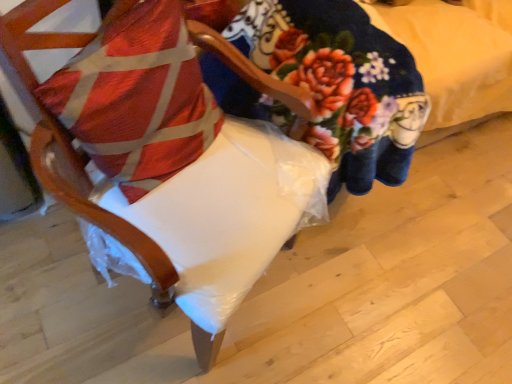
Question: Is textured red pillow at left taller or shorter than white fabric chair at center?

Choices:
 (A) short
 (B) tall

Answer: (A)

Question: Is textured red pillow at left spatially inside white fabric chair at center, or outside of it?

Choices:
 (A) outside
 (B) inside

Answer: (B)

Question: From a real-world perspective, is textured red pillow at left positioned above or below white fabric chair at center?

Choices:
 (A) below
 (B) above

Answer: (B)

Question: From the image's perspective, is white fabric chair at center located above or below textured red pillow at left?

Choices:
 (A) above
 (B) below

Answer: (B)

Question: Is white fabric chair at center in front of or behind textured red pillow at left in the image?

Choices:
 (A) front
 (B) behind

Answer: (A)

Question: Considering the positions of white fabric chair at center and textured red pillow at left in the image, is white fabric chair at center taller or shorter than textured red pillow at left?

Choices:
 (A) short
 (B) tall

Answer: (B)

Question: From a real-world perspective, is white fabric chair at center above or below textured red pillow at left?

Choices:
 (A) below
 (B) above

Answer: (A)